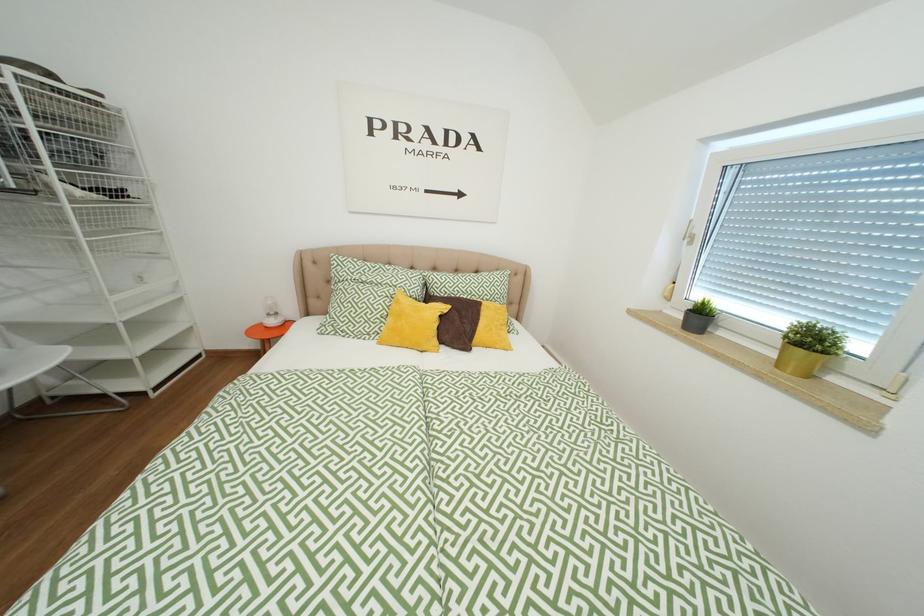
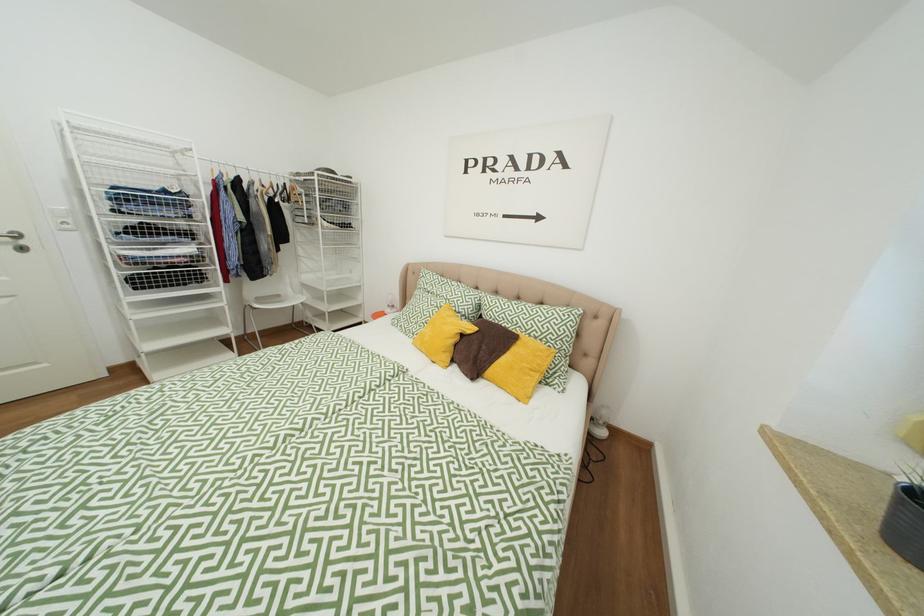
Question: The camera is either moving clockwise (left) or counter-clockwise (right) around the object. The first image is from the beginning of the video and the second image is from the end. Is the camera moving left or right when shooting the video?

Choices:
 (A) Left
 (B) Right

Answer: (B)